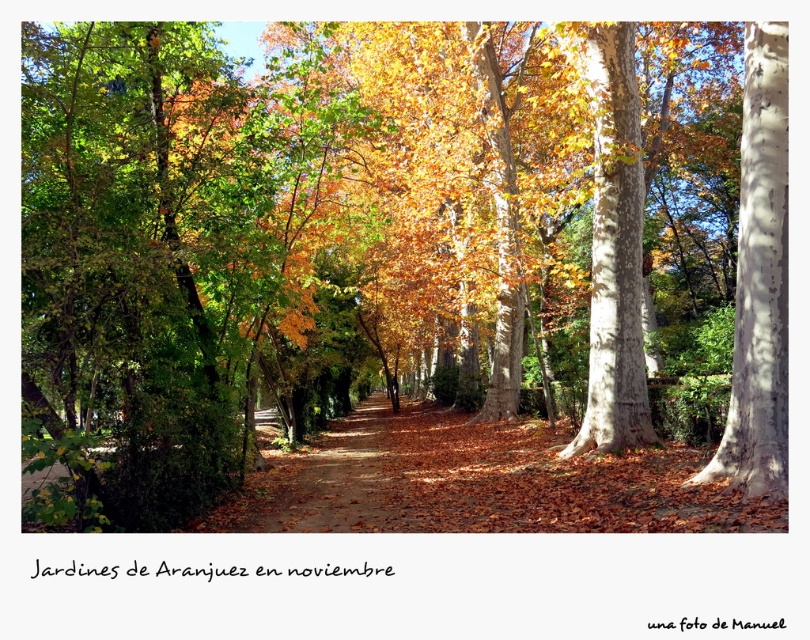
Question: Which point is farther to the camera?

Choices:
 (A) smooth white bark at center
 (B) brown dirt path at center
 (C) smooth bark tree at center

Answer: (C)

Question: Can you confirm if smooth bark tree at center is thinner than brown dirt path at center?

Choices:
 (A) yes
 (B) no

Answer: (A)

Question: Which point appears closest to the camera in this image?

Choices:
 (A) (340, 464)
 (B) (642, 212)

Answer: (B)

Question: Which object is closer to the camera taking this photo?

Choices:
 (A) smooth bark tree at center
 (B) smooth white bark at center

Answer: (B)

Question: Is smooth white bark at center behind brown dirt path at center?

Choices:
 (A) no
 (B) yes

Answer: (A)

Question: Does smooth bark tree at center appear over brown dirt path at center?

Choices:
 (A) no
 (B) yes

Answer: (B)